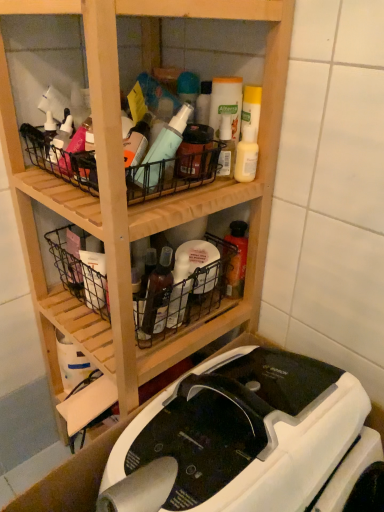
What is the approximate height of wooden shelf at center?

The height of wooden shelf at center is 3.61 feet.

The image size is (384, 512). Describe the element at coordinates (173, 173) in the screenshot. I see `black wire basket at upper center, marked as the 1th basket in a top-to-bottom arrangement` at that location.

Locate an element on the screen. This screenshot has width=384, height=512. black wire basket at center, which is the second basket in top-to-bottom order is located at coordinates (x=183, y=298).

In the image, is black wire basket at center, the 1th basket positioned from the bottom, positioned in front of or behind wooden shelf at center?

Visually, black wire basket at center, the 1th basket positioned from the bottom, is located behind wooden shelf at center.

Between black wire basket at center, which is the second basket in top-to-bottom order, and wooden shelf at center, which one appears on the left side from the viewer's perspective?

From the viewer's perspective, black wire basket at center, which is the second basket in top-to-bottom order, appears more on the left side.

From a real-world perspective, is black wire basket at center, the 1th basket positioned from the bottom, physically located above or below wooden shelf at center?

Clearly, from a real-world perspective, black wire basket at center, the 1th basket positioned from the bottom, is above wooden shelf at center.

From the image's perspective, is white plastic sewing machine at lower center positioned above or below wooden shelf at center?

Based on their image positions, white plastic sewing machine at lower center is located beneath wooden shelf at center.

Considering the relative sizes of white plastic sewing machine at lower center and wooden shelf at center in the image provided, is white plastic sewing machine at lower center taller than wooden shelf at center?

No, white plastic sewing machine at lower center is not taller than wooden shelf at center.

Is white plastic sewing machine at lower center positioned beyond the bounds of wooden shelf at center?

Yes, white plastic sewing machine at lower center is not within wooden shelf at center.

At what (x,y) coordinates should I click in order to perform the action: click on shelf that appears above the white plastic sewing machine at lower center (from a real-world perspective). Please return your answer as a coordinate pair (x, y). This screenshot has width=384, height=512. Looking at the image, I should click on (147, 202).

Is black wire basket at center, the 1th basket positioned from the bottom, shorter than white plastic sewing machine at lower center?

Yes.

From the image's perspective, which one is positioned lower, black wire basket at center, the 1th basket positioned from the bottom, or white plastic sewing machine at lower center?

white plastic sewing machine at lower center.

From the image's perspective, which is below, black wire basket at upper center, marked as the 1th basket in a top-to-bottom arrangement, or white plastic sewing machine at lower center?

From the image's view, white plastic sewing machine at lower center is below.

Which basket is the 2nd one when counting from the left side of the white plastic sewing machine at lower center? Please provide its 2D coordinates.

[(173, 173)]

Is black wire basket at upper center, the second basket from the bottom, looking in the opposite direction of white plastic sewing machine at lower center?

black wire basket at upper center, the second basket from the bottom, is not turned away from white plastic sewing machine at lower center.

Measure the distance from black wire basket at upper center, the second basket from the bottom, to white plastic sewing machine at lower center.

black wire basket at upper center, the second basket from the bottom, is 16.85 inches away from white plastic sewing machine at lower center.

Can you confirm if black wire basket at upper center, the second basket from the bottom, is smaller than black wire basket at center, which is the second basket in top-to-bottom order?

Indeed, black wire basket at upper center, the second basket from the bottom, has a smaller size compared to black wire basket at center, which is the second basket in top-to-bottom order.

Which object is closer to the camera, black wire basket at upper center, the second basket from the bottom, or black wire basket at center, the 1th basket positioned from the bottom?

black wire basket at upper center, the second basket from the bottom.

Who is shorter, black wire basket at upper center, the second basket from the bottom, or black wire basket at center, the 1th basket positioned from the bottom?

With less height is black wire basket at upper center, the second basket from the bottom.

Can you confirm if black wire basket at upper center, marked as the 1th basket in a top-to-bottom arrangement, is wider than black wire basket at center, which is the second basket in top-to-bottom order?

Incorrect, the width of black wire basket at upper center, marked as the 1th basket in a top-to-bottom arrangement, does not surpass that of black wire basket at center, which is the second basket in top-to-bottom order.

Looking at this image, can you confirm if wooden shelf at center is bigger than white plastic sewing machine at lower center?

Yes, wooden shelf at center is bigger than white plastic sewing machine at lower center.

Considering the sizes of objects wooden shelf at center and white plastic sewing machine at lower center in the image provided, who is thinner, wooden shelf at center or white plastic sewing machine at lower center?

wooden shelf at center is thinner.

Is point (110, 126) more distant than point (342, 397)?

No, (110, 126) is closer to viewer.

Which object is more forward, wooden shelf at center or white plastic sewing machine at lower center?

white plastic sewing machine at lower center is more forward.

Is white plastic sewing machine at lower center not inside black wire basket at center, the 1th basket positioned from the bottom?

Yes, white plastic sewing machine at lower center is located beyond the bounds of black wire basket at center, the 1th basket positioned from the bottom.

Is white plastic sewing machine at lower center turned away from black wire basket at center, which is the second basket in top-to-bottom order?

white plastic sewing machine at lower center is not turned away from black wire basket at center, which is the second basket in top-to-bottom order.

Which is less distant, (x=230, y=483) or (x=211, y=308)?

Point (x=230, y=483) is closer to the camera than point (x=211, y=308).

This screenshot has width=384, height=512. Find the location of `basket that is the 2nd object located behind the wooden shelf at center`. basket that is the 2nd object located behind the wooden shelf at center is located at coordinates (183, 298).

Locate an element on the screen. This screenshot has height=512, width=384. sewing machine in front of the wooden shelf at center is located at coordinates (253, 435).

Looking at the image, which one is located closer to white plastic sewing machine at lower center, black wire basket at center, the 1th basket positioned from the bottom, or wooden shelf at center?

black wire basket at center, the 1th basket positioned from the bottom, is closer to white plastic sewing machine at lower center.

From the image, which object appears to be nearer to black wire basket at center, the 1th basket positioned from the bottom, white plastic sewing machine at lower center or wooden shelf at center?

wooden shelf at center.

Considering their positions, is black wire basket at center, which is the second basket in top-to-bottom order, positioned further to wooden shelf at center than white plastic sewing machine at lower center?

The object further to wooden shelf at center is white plastic sewing machine at lower center.

Estimate the real-world distances between objects in this image. Which object is further from white plastic sewing machine at lower center, black wire basket at upper center, marked as the 1th basket in a top-to-bottom arrangement, or wooden shelf at center?

Among the two, black wire basket at upper center, marked as the 1th basket in a top-to-bottom arrangement, is located further to white plastic sewing machine at lower center.

From the image, which object appears to be farther from black wire basket at upper center, the second basket from the bottom, wooden shelf at center or black wire basket at center, the 1th basket positioned from the bottom?

Among the two, black wire basket at center, the 1th basket positioned from the bottom, is located further to black wire basket at upper center, the second basket from the bottom.

Based on their spatial positions, is wooden shelf at center or black wire basket at upper center, marked as the 1th basket in a top-to-bottom arrangement, further from white plastic sewing machine at lower center?

The object further to white plastic sewing machine at lower center is black wire basket at upper center, marked as the 1th basket in a top-to-bottom arrangement.

From the image, which object appears to be nearer to white plastic sewing machine at lower center, black wire basket at upper center, marked as the 1th basket in a top-to-bottom arrangement, or black wire basket at center, which is the second basket in top-to-bottom order?

The object closer to white plastic sewing machine at lower center is black wire basket at center, which is the second basket in top-to-bottom order.

Considering their positions, is black wire basket at upper center, the second basket from the bottom, positioned closer to black wire basket at center, the 1th basket positioned from the bottom, than wooden shelf at center?

Based on the image, wooden shelf at center appears to be nearer to black wire basket at center, the 1th basket positioned from the bottom.

This screenshot has width=384, height=512. Identify the location of shelf between black wire basket at upper center, the second basket from the bottom, and white plastic sewing machine at lower center, in the vertical direction. (147, 202).

Find the location of a particular element. The width and height of the screenshot is (384, 512). shelf that lies between black wire basket at center, which is the second basket in top-to-bottom order, and white plastic sewing machine at lower center from top to bottom is located at coordinates (147, 202).

In order to click on basket between black wire basket at upper center, marked as the 1th basket in a top-to-bottom arrangement, and white plastic sewing machine at lower center, in the vertical direction in this screenshot , I will do `click(183, 298)`.

Where is `basket between wooden shelf at center and black wire basket at center, which is the second basket in top-to-bottom order, along the z-axis`? The height and width of the screenshot is (512, 384). basket between wooden shelf at center and black wire basket at center, which is the second basket in top-to-bottom order, along the z-axis is located at coordinates (173, 173).